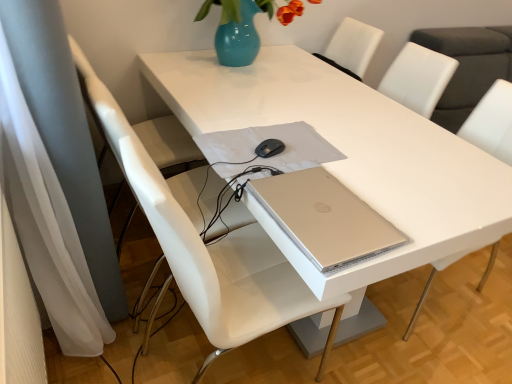
You are a GUI agent. You are given a task and a screenshot of the screen. Output one action in this format:
    pyautogui.click(x=<x>, y=<y>)
    Task: Click on the white leather chair at center, the first chair viewed from the left
    The width and height of the screenshot is (512, 384).
    Given the screenshot: What is the action you would take?
    pyautogui.click(x=199, y=236)

Find the location of a particular element. white glossy table at center is located at coordinates (349, 154).

What are the coordinates of `silver metallic laptop at center` in the screenshot? It's located at (325, 218).

What is the approximate height of white plastic swivel chair at left?

37.00 inches.

What do you see at coordinates (237, 29) in the screenshot? The width and height of the screenshot is (512, 384). I see `matte blue vase at upper center` at bounding box center [237, 29].

In order to click on white leather chair at center, placed as the 2th chair when sorted from left to right in this screenshot , I will do `click(492, 122)`.

The height and width of the screenshot is (384, 512). Find the location of `white leather chair at center, marked as the second chair in a right-to-left arrangement`. white leather chair at center, marked as the second chair in a right-to-left arrangement is located at coordinates (199, 236).

Considering the relative sizes of silver metallic laptop at center and matte blue vase at upper center in the image provided, is silver metallic laptop at center smaller than matte blue vase at upper center?

Correct, silver metallic laptop at center occupies less space than matte blue vase at upper center.

Which object is closer to the camera, silver metallic laptop at center or matte blue vase at upper center?

silver metallic laptop at center.

Does point (340, 240) come closer to viewer compared to point (234, 52)?

That is True.

In the image, is silver metallic laptop at center on the left side or the right side of matte blue vase at upper center?

From the image, it's evident that silver metallic laptop at center is to the right of matte blue vase at upper center.

Does matte blue vase at upper center appear on the left side of white glossy table at center?

Yes.

Which is closer, [244,29] or [284,48]?

Point [244,29].

Is white glossy table at center surrounded by matte blue vase at upper center?

No, white glossy table at center is located outside of matte blue vase at upper center.

From a real-world perspective, is matte blue vase at upper center physically above white glossy table at center?

Yes.

From a real-world perspective, is white leather chair at center, the first chair viewed from the left, above or below white leather chair at center, which appears as the 1th chair when viewed from the right?

white leather chair at center, the first chair viewed from the left, is above white leather chair at center, which appears as the 1th chair when viewed from the right.

Is white leather chair at center, the first chair viewed from the left, inside the boundaries of white leather chair at center, which appears as the 1th chair when viewed from the right, or outside?

white leather chair at center, the first chair viewed from the left, is spatially situated outside white leather chair at center, which appears as the 1th chair when viewed from the right.

Which of these two, white leather chair at center, marked as the second chair in a right-to-left arrangement, or white leather chair at center, placed as the 2th chair when sorted from left to right, is wider?

Wider between the two is white leather chair at center, placed as the 2th chair when sorted from left to right.

Which object is positioned more to the right, white leather chair at center, marked as the second chair in a right-to-left arrangement, or white leather chair at center, placed as the 2th chair when sorted from left to right?

From the viewer's perspective, white leather chair at center, placed as the 2th chair when sorted from left to right, appears more on the right side.

Between white glossy table at center and white leather chair at center, which appears as the 1th chair when viewed from the right, which one is positioned in front?

white glossy table at center is in front.

In the scene shown: Do you think white glossy table at center is within white leather chair at center, which appears as the 1th chair when viewed from the right, or outside of it?

white glossy table at center is not enclosed by white leather chair at center, which appears as the 1th chair when viewed from the right.

At what (x,y) coordinates should I click in order to perform the action: click on chair on the right of white glossy table at center. Please return your answer as a coordinate pair (x, y). Looking at the image, I should click on (492, 122).

Considering the relative positions of white glossy table at center and white leather chair at center, which appears as the 1th chair when viewed from the right, in the image provided, is white glossy table at center to the left of white leather chair at center, which appears as the 1th chair when viewed from the right, from the viewer's perspective?

Yes, white glossy table at center is to the left of white leather chair at center, which appears as the 1th chair when viewed from the right.

Based on the photo, from the image's perspective, would you say white plastic swivel chair at left is positioned over white glossy table at center?

Yes, from the image's perspective, white plastic swivel chair at left is over white glossy table at center.

You are a GUI agent. You are given a task and a screenshot of the screen. Output one action in this format:
    pyautogui.click(x=<x>, y=<y>)
    Task: Click on the table in front of the white plastic swivel chair at left
    The width and height of the screenshot is (512, 384).
    Given the screenshot: What is the action you would take?
    pyautogui.click(x=349, y=154)

Considering their positions, is white plastic swivel chair at left located in front of or behind white glossy table at center?

Clearly, white plastic swivel chair at left is behind white glossy table at center.

In terms of height, does white plastic swivel chair at left look taller or shorter compared to white glossy table at center?

white plastic swivel chair at left is taller than white glossy table at center.

From the image's perspective, between matte blue vase at upper center and silver metallic laptop at center, which one is located above?

matte blue vase at upper center appears higher in the image.

Is matte blue vase at upper center touching silver metallic laptop at center?

matte blue vase at upper center and silver metallic laptop at center are clearly separated.

Looking at this image, is silver metallic laptop at center at the back of matte blue vase at upper center?

No, silver metallic laptop at center is not at the back of matte blue vase at upper center.

Which is more distant, (254, 52) or (341, 263)?

The point (254, 52) is behind.

Is point (252, 255) positioned after point (315, 2)?

No, it is not.

Is matte blue vase at upper center at the back of white leather chair at center, marked as the second chair in a right-to-left arrangement?

That's not correct — white leather chair at center, marked as the second chair in a right-to-left arrangement, is not looking away from matte blue vase at upper center.

In terms of size, does white leather chair at center, the first chair viewed from the left, appear bigger or smaller than matte blue vase at upper center?

Considering their sizes, white leather chair at center, the first chair viewed from the left, takes up more space than matte blue vase at upper center.

From a real-world perspective, is white leather chair at center, marked as the second chair in a right-to-left arrangement, positioned above or below matte blue vase at upper center?

white leather chair at center, marked as the second chair in a right-to-left arrangement, is below matte blue vase at upper center.

This screenshot has width=512, height=384. I want to click on floral arrangement that is above the silver metallic laptop at center (from a real-world perspective), so click(x=237, y=29).

You are a GUI agent. You are given a task and a screenshot of the screen. Output one action in this format:
    pyautogui.click(x=<x>, y=<y>)
    Task: Click on the table that is in front of the matte blue vase at upper center
    
    Given the screenshot: What is the action you would take?
    pyautogui.click(x=349, y=154)

Looking at the image, which one is located closer to white plastic swivel chair at left, white leather chair at center, which appears as the 1th chair when viewed from the right, or matte blue vase at upper center?

Among the two, matte blue vase at upper center is located nearer to white plastic swivel chair at left.

Looking at the image, which one is located closer to white leather chair at center, marked as the second chair in a right-to-left arrangement, white plastic swivel chair at left or white glossy table at center?

white glossy table at center is closer to white leather chair at center, marked as the second chair in a right-to-left arrangement.

When comparing their distances from white glossy table at center, does white leather chair at center, the first chair viewed from the left, or white leather chair at center, which appears as the 1th chair when viewed from the right, seem further?

Based on the image, white leather chair at center, which appears as the 1th chair when viewed from the right, appears to be further to white glossy table at center.

Considering their positions, is silver metallic laptop at center positioned further to matte blue vase at upper center than white glossy table at center?

Based on the image, silver metallic laptop at center appears to be further to matte blue vase at upper center.

Estimate the real-world distances between objects in this image. Which object is further from white glossy table at center, silver metallic laptop at center or white leather chair at center, placed as the 2th chair when sorted from left to right?

white leather chair at center, placed as the 2th chair when sorted from left to right, is further to white glossy table at center.

When comparing their distances from white leather chair at center, placed as the 2th chair when sorted from left to right, does matte blue vase at upper center or white leather chair at center, marked as the second chair in a right-to-left arrangement, seem further?

white leather chair at center, marked as the second chair in a right-to-left arrangement, lies further to white leather chair at center, placed as the 2th chair when sorted from left to right, than the other object.

From the image, which object appears to be nearer to silver metallic laptop at center, white leather chair at center, placed as the 2th chair when sorted from left to right, or white plastic swivel chair at left?

white leather chair at center, placed as the 2th chair when sorted from left to right, lies closer to silver metallic laptop at center than the other object.

Consider the image. Estimate the real-world distances between objects in this image. Which object is closer to white glossy table at center, silver metallic laptop at center or white leather chair at center, the first chair viewed from the left?

Among the two, silver metallic laptop at center is located nearer to white glossy table at center.

Locate an element on the screen. table between white plastic swivel chair at left and silver metallic laptop at center in the horizontal direction is located at coordinates (349, 154).

Image resolution: width=512 pixels, height=384 pixels. Identify the location of swivel chair between matte blue vase at upper center and silver metallic laptop at center in the up-down direction. (99, 102).

Find the location of `chair between white plastic swivel chair at left and white leather chair at center, placed as the 2th chair when sorted from left to right, in the horizontal direction`. chair between white plastic swivel chair at left and white leather chair at center, placed as the 2th chair when sorted from left to right, in the horizontal direction is located at coordinates click(199, 236).

The height and width of the screenshot is (384, 512). I want to click on computer between white glossy table at center and white leather chair at center, which appears as the 1th chair when viewed from the right, so 325,218.